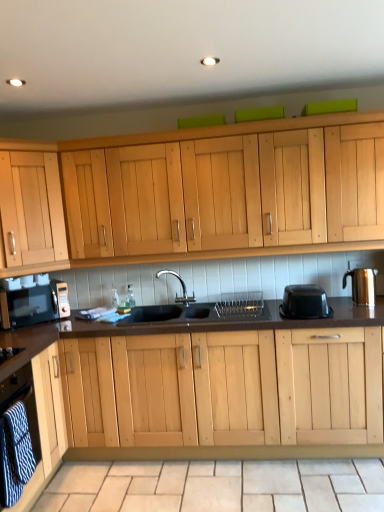
Question: Is light wood cabinet at lower left, placed as the 2th cabinetry when sorted from top to bottom, in contact with black plastic container at right?

Choices:
 (A) no
 (B) yes

Answer: (A)

Question: Is light wood cabinet at lower left, placed as the 2th cabinetry when sorted from top to bottom, further to the viewer compared to black plastic container at right?

Choices:
 (A) yes
 (B) no

Answer: (B)

Question: From a real-world perspective, is light wood cabinet at lower left, which is the first cabinetry from front to back, on black plastic container at right?

Choices:
 (A) yes
 (B) no

Answer: (B)

Question: Does light wood cabinet at lower left, which is the first cabinetry from front to back, appear on the right side of black plastic container at right?

Choices:
 (A) yes
 (B) no

Answer: (B)

Question: From a real-world perspective, is light wood cabinet at lower left, the first cabinetry ordered from the bottom, below black plastic container at right?

Choices:
 (A) yes
 (B) no

Answer: (A)

Question: From the image's perspective, relative to light wood cabinet at upper left, marked as the 1th cabinetry in a back-to-front arrangement, is light wood cabinet at lower left, which is the first cabinetry from front to back, above or below?

Choices:
 (A) above
 (B) below

Answer: (B)

Question: Is light wood cabinet at lower left, the first cabinetry ordered from the bottom, inside or outside of light wood cabinet at upper left, which is counted as the second cabinetry, starting from the front?

Choices:
 (A) outside
 (B) inside

Answer: (A)

Question: Is light wood cabinet at lower left, placed as the 2th cabinetry when sorted from top to bottom, taller or shorter than light wood cabinet at upper left, marked as the 1th cabinetry in a back-to-front arrangement?

Choices:
 (A) tall
 (B) short

Answer: (B)

Question: Is light wood cabinet at lower left, acting as the 2th cabinetry starting from the back, in front of or behind light wood cabinet at upper left, acting as the first cabinetry starting from the top, in the image?

Choices:
 (A) front
 (B) behind

Answer: (A)

Question: Is point (177, 498) positioned closer to the camera than point (31, 486)?

Choices:
 (A) farther
 (B) closer

Answer: (A)

Question: From the image's perspective, is beige tile at lower center above or below light wood cabinet at lower left, the first cabinetry ordered from the bottom?

Choices:
 (A) above
 (B) below

Answer: (B)

Question: Is beige tile at lower center in front of or behind light wood cabinet at lower left, placed as the 2th cabinetry when sorted from top to bottom, in the image?

Choices:
 (A) behind
 (B) front

Answer: (A)

Question: Would you say beige tile at lower center is inside or outside light wood cabinet at lower left, acting as the 2th cabinetry starting from the back?

Choices:
 (A) outside
 (B) inside

Answer: (A)

Question: In terms of width, does black matte sink at center look wider or thinner when compared to black plastic container at right?

Choices:
 (A) wide
 (B) thin

Answer: (A)

Question: Considering their positions, is black matte sink at center located in front of or behind black plastic container at right?

Choices:
 (A) behind
 (B) front

Answer: (A)